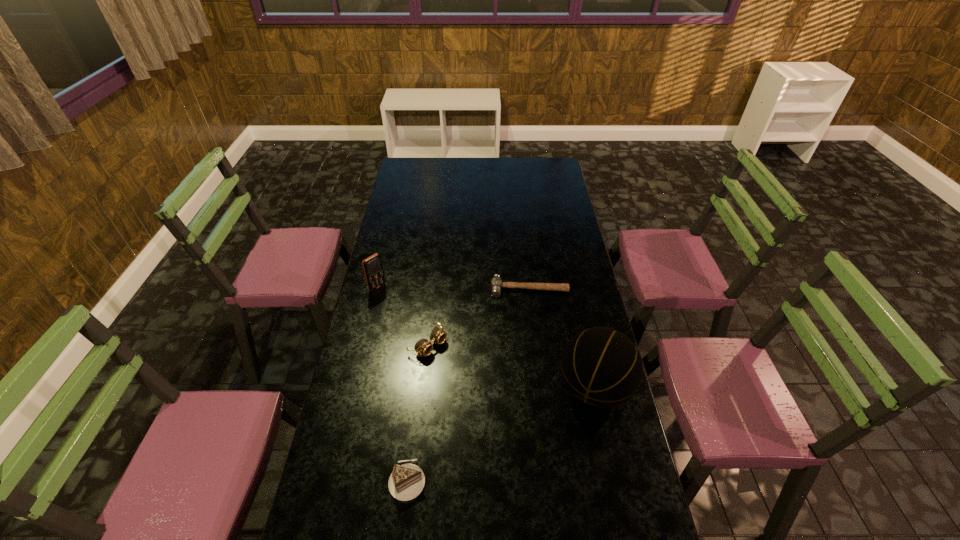
Image resolution: width=960 pixels, height=540 pixels. In order to click on the nearest object in this screenshot , I will do `click(406, 482)`.

Locate an element on the screen. The width and height of the screenshot is (960, 540). the tallest object is located at coordinates (601, 367).

This screenshot has height=540, width=960. Find the location of `goggles`. goggles is located at coordinates pos(438,336).

Identify the location of the leftmost object. point(373,269).

Where is `the second tallest object`? Image resolution: width=960 pixels, height=540 pixels. the second tallest object is located at coordinates click(373, 269).

Identify the location of the shortest object. (496, 283).

You are a GUI agent. You are given a task and a screenshot of the screen. Output one action in this format:
    pyautogui.click(x=<x>, y=<y>)
    Task: Click on the vacant region located 0.270m on the back of the nearest object
    The width and height of the screenshot is (960, 540).
    Given the screenshot: What is the action you would take?
    pyautogui.click(x=419, y=381)

Locate an element on the screen. This screenshot has width=960, height=540. blank space located on the front of the basketball is located at coordinates (612, 471).

Identify the location of free region located 0.110m through the lenses of the goggles. (465, 372).

Where is `vacant space located 0.090m through the lenses of the goggles`? Image resolution: width=960 pixels, height=540 pixels. vacant space located 0.090m through the lenses of the goggles is located at coordinates (460, 368).